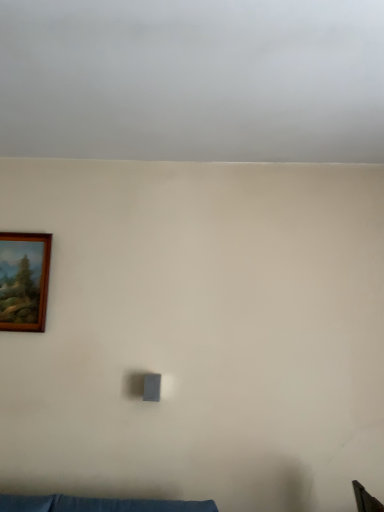
Question: Is gray matte cloud at upper center in front of or behind wooden picture frame at upper left in the image?

Choices:
 (A) behind
 (B) front

Answer: (B)

Question: Based on their sizes in the image, would you say gray matte cloud at upper center is bigger or smaller than wooden picture frame at upper left?

Choices:
 (A) small
 (B) big

Answer: (B)

Question: Is gray matte cloud at upper center spatially inside wooden picture frame at upper left, or outside of it?

Choices:
 (A) outside
 (B) inside

Answer: (A)

Question: Is wooden picture frame at upper left inside or outside of gray matte cloud at upper center?

Choices:
 (A) outside
 (B) inside

Answer: (A)

Question: Based on their sizes in the image, would you say wooden picture frame at upper left is bigger or smaller than gray matte cloud at upper center?

Choices:
 (A) small
 (B) big

Answer: (A)

Question: Considering their positions, is wooden picture frame at upper left located in front of or behind gray matte cloud at upper center?

Choices:
 (A) front
 (B) behind

Answer: (B)

Question: Looking at their shapes, would you say wooden picture frame at upper left is wider or thinner than gray matte cloud at upper center?

Choices:
 (A) wide
 (B) thin

Answer: (B)